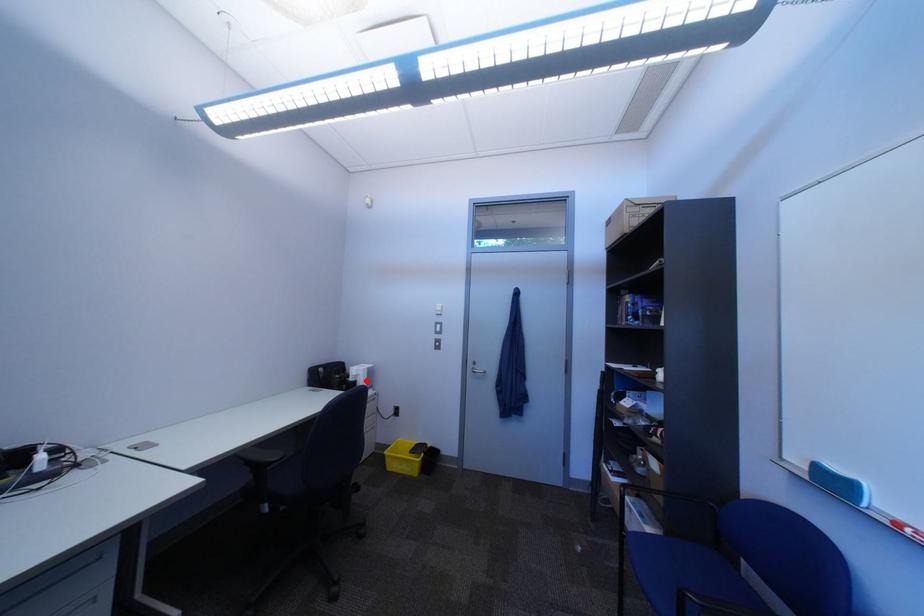
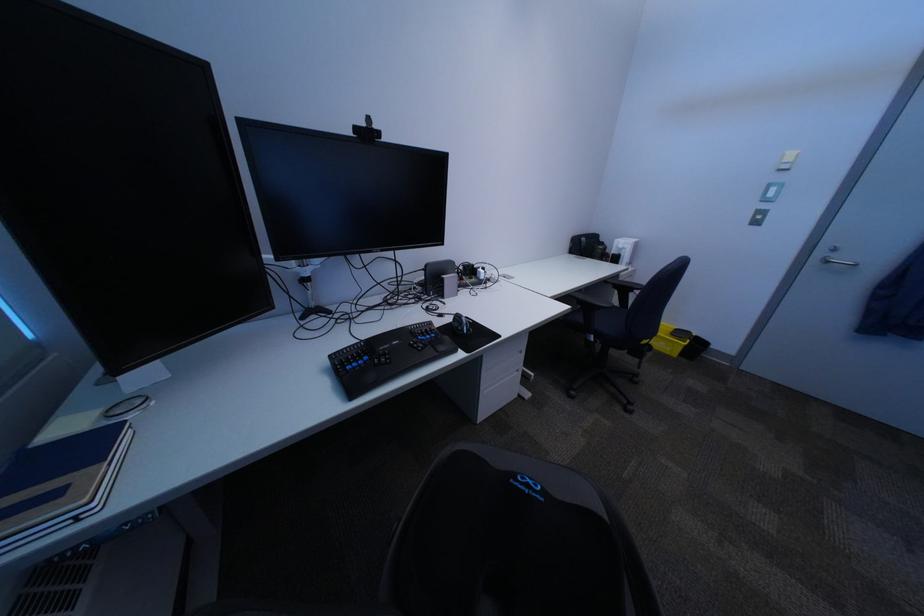
Locate, in the second image, the point that corresponds to the highlighted location in the first image.

(628, 254)